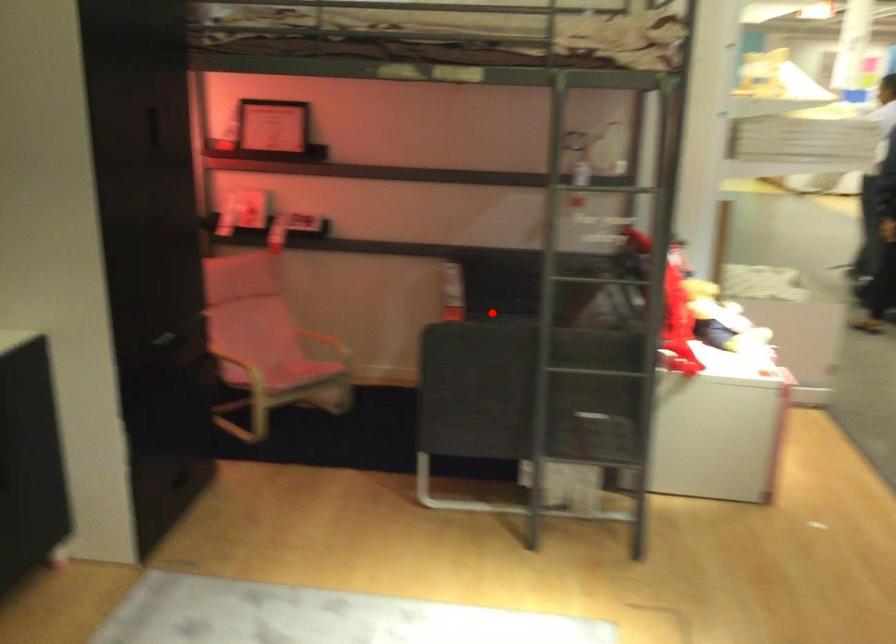
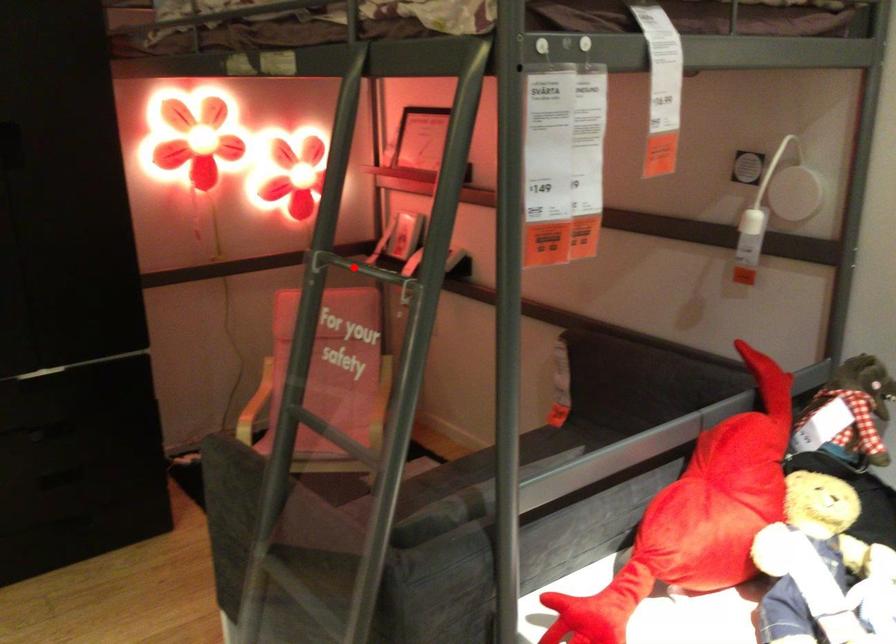
I am providing you with two images of the same scene from different viewpoints. A red point is marked on the first image and another point is marked on the second image. Is the marked point in image1 the same physical position as the marked point in image2?

No